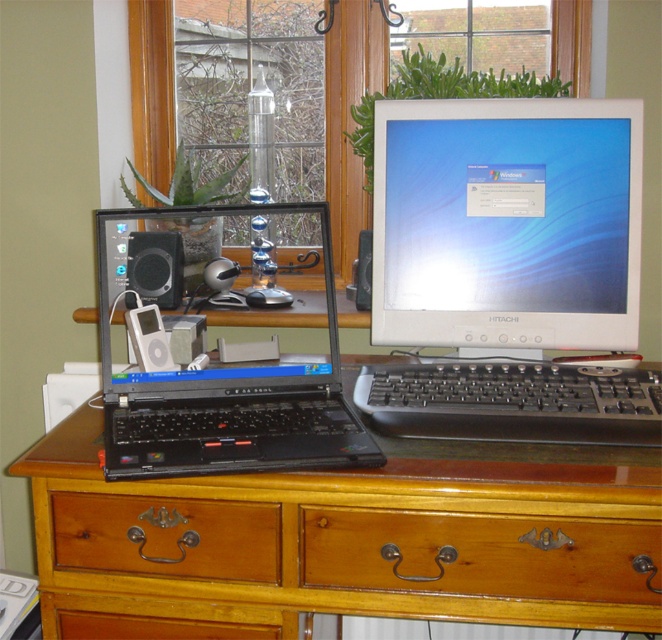
You are a delivery person who needs to place a camera on the desk without blocking the brown wood computer desk at center. The camera must be placed exactly 34.89 inches away from the desk. Is there enough space on the desk to do this?

The camera must be placed exactly 34.89 inches away from the brown wood computer desk at center, but the desk itself is the surface where the camera would be placed. Therefore, it is not possible to place the camera on the desk while maintaining that distance from the desk itself.

You are setting up a new monitor that requires 15 cm of clearance above the desk. Given the brown wood computer desk at center and the black plastic laptop at left, can the monitor be placed on the desk without obstructing the laptop?

The brown wood computer desk at center has a lesser height compared to the black plastic laptop at left, so the desk is shorter than the laptop. However, since the laptop is placed on the desk, the desk itself provides the base surface. The required clearance for the monitor is 15 cm above the desk, which is unrelated to the desk height. Therefore, as long as there is enough space on the desk surface, the monitor can be placed there without issue.

You are a person sitting at the brown wood computer desk at center. You want to reach the black plastic keyboard at center without moving your chair. Can you do it?

The brown wood computer desk at center is in front of the black plastic keyboard at center, so the keyboard is positioned behind you. You would need to move your chair forward or lean back to reach it.